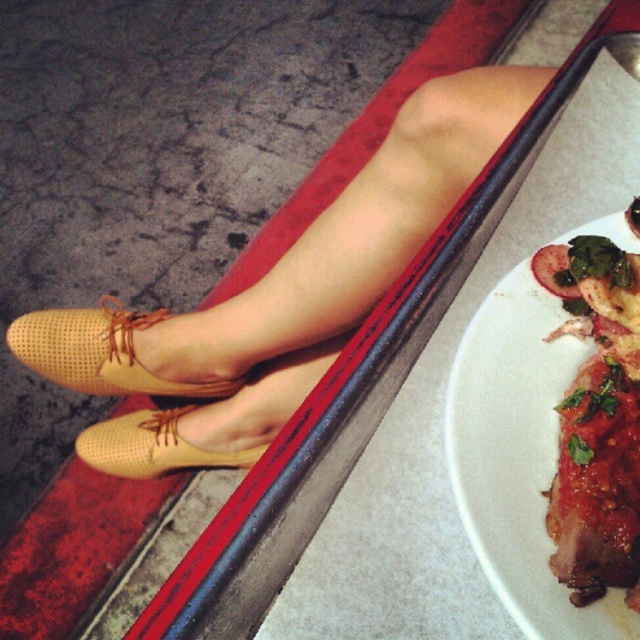
Question: Does matte white plate at lower right have a larger size compared to tan perforated shoe at lower left?

Choices:
 (A) yes
 (B) no

Answer: (B)

Question: Which object is the farthest from the tan perforated shoes at center?

Choices:
 (A) tan perforated shoe at center
 (B) tan perforated shoe at lower left

Answer: (B)

Question: Is tan perforated shoes at center further to the viewer compared to tan perforated shoe at center?

Choices:
 (A) no
 (B) yes

Answer: (A)

Question: Which is farther from the tan perforated shoe at lower left?

Choices:
 (A) tan perforated shoe at center
 (B) matte white plate at lower right

Answer: (B)

Question: Which point is closer to the camera taking this photo?

Choices:
 (A) (112, 310)
 (B) (602, 532)
 (C) (467, 156)
 (D) (301, 353)

Answer: (B)

Question: Where is matte white plate at lower right located in relation to tan perforated shoe at lower left in the image?

Choices:
 (A) left
 (B) right

Answer: (B)